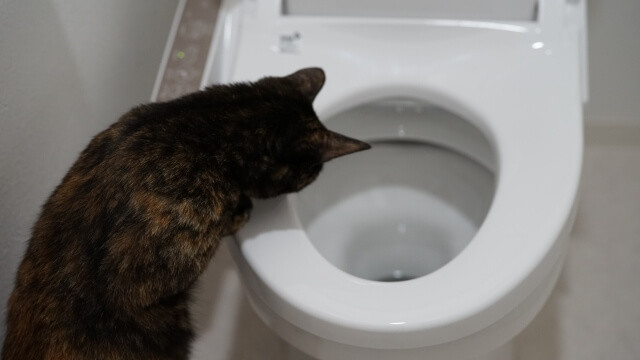
You are a GUI agent. You are given a task and a screenshot of the screen. Output one action in this format:
    pyautogui.click(x=<x>, y=<y>)
    Task: Click on the floor
    Image resolution: width=640 pixels, height=360 pixels.
    Given the screenshot: What is the action you would take?
    coord(205,64)